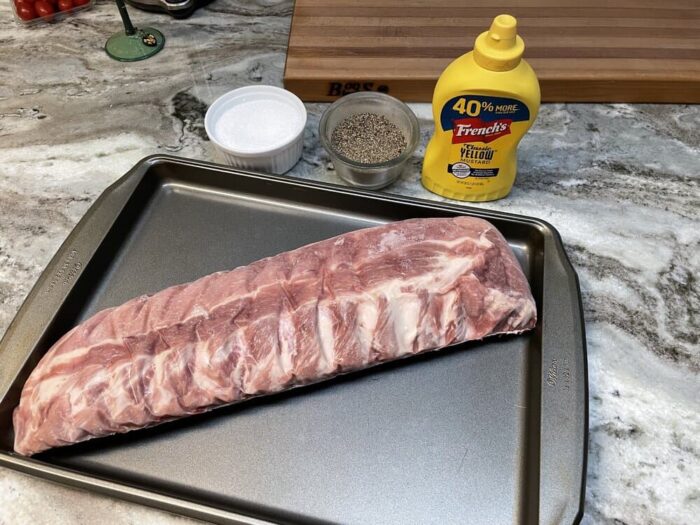
I want to click on clear spice cup, so click(x=386, y=164).